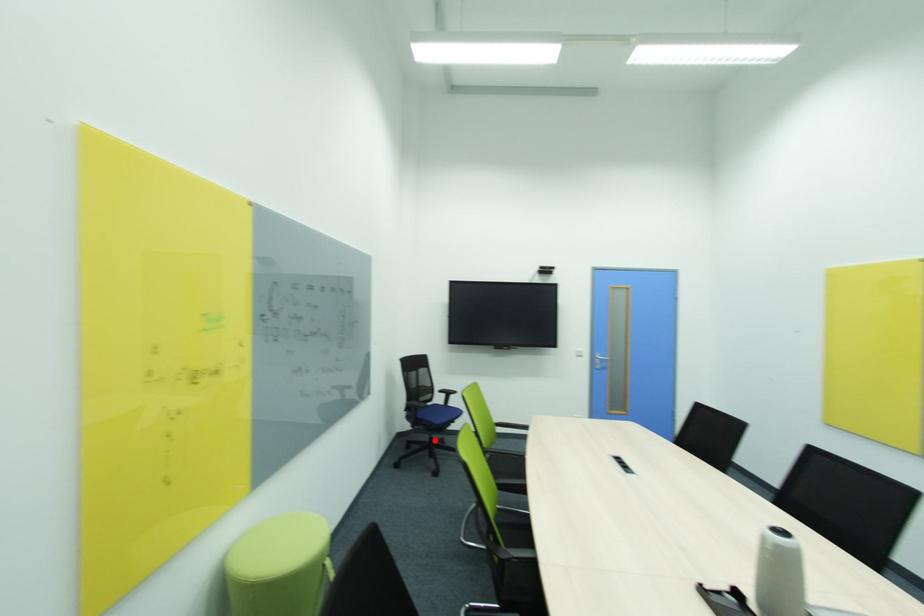
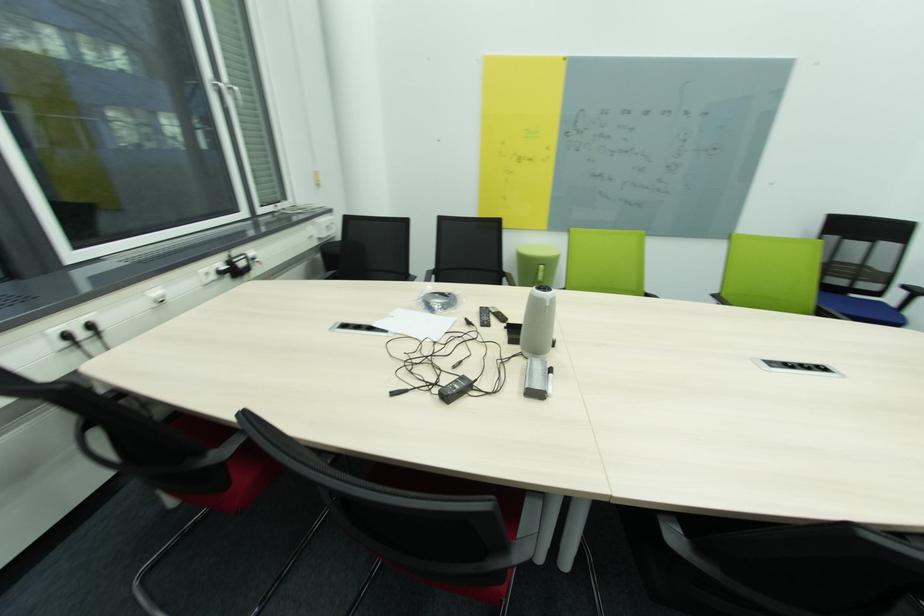
Question: I am providing you with two images of the same scene from different viewpoints. A red point is marked on the first image. At the location where the point appears in image 1, is it still visible in image 2?

Choices:
 (A) Yes
 (B) No

Answer: (B)